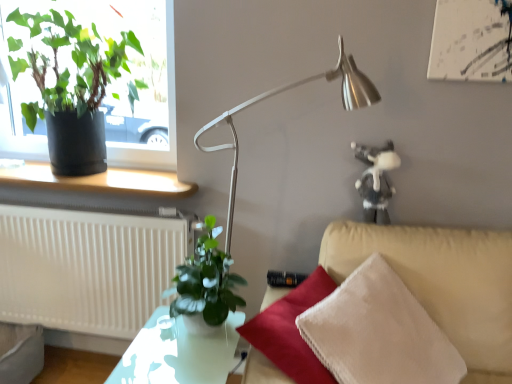
Locate an element on the screen. The width and height of the screenshot is (512, 384). free point below green matte plant at center, the second houseplant viewed from the top (from a real-world perspective) is located at coordinates (197, 337).